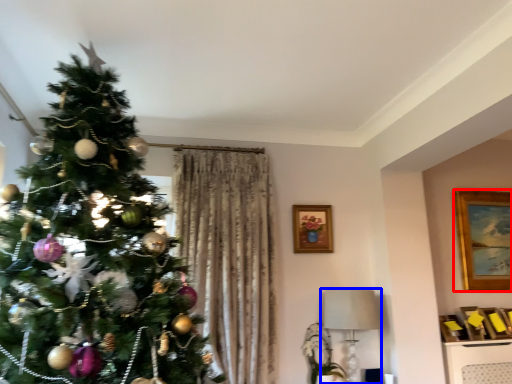
Question: Which object appears closest to the camera in this image, picture frame (highlighted by a red box) or lamp (highlighted by a blue box)?

Choices:
 (A) picture frame
 (B) lamp

Answer: (B)